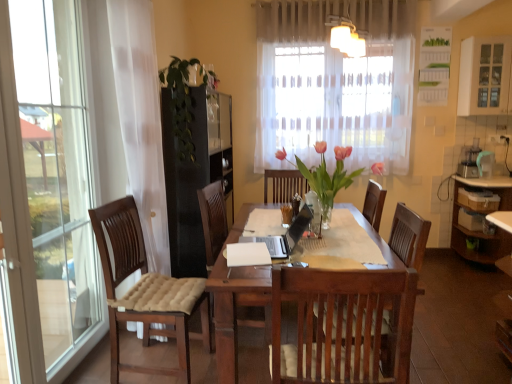
Question: Does translucent glass vase at center, acting as the 2th floral arrangement starting from the left, appear on the left side of green leafy plant at center, which is the second floral arrangement in right-to-left order?

Choices:
 (A) yes
 (B) no

Answer: (B)

Question: Does translucent glass vase at center, the first floral arrangement positioned from the right, lie in front of green leafy plant at center, placed as the 1th floral arrangement when sorted from left to right?

Choices:
 (A) no
 (B) yes

Answer: (B)

Question: Would you consider translucent glass vase at center, acting as the 2th floral arrangement starting from the left, to be distant from green leafy plant at center, which is the second floral arrangement in front-to-back order?

Choices:
 (A) yes
 (B) no

Answer: (A)

Question: Considering the relative sizes of translucent glass vase at center, the second floral arrangement in the back-to-front sequence, and green leafy plant at center, which is the second floral arrangement in front-to-back order, in the image provided, is translucent glass vase at center, the second floral arrangement in the back-to-front sequence, bigger than green leafy plant at center, which is the second floral arrangement in front-to-back order,?

Choices:
 (A) no
 (B) yes

Answer: (B)

Question: From the image's perspective, is translucent glass vase at center, acting as the first floral arrangement starting from the front, located beneath green leafy plant at center, which is the second floral arrangement in right-to-left order?

Choices:
 (A) no
 (B) yes

Answer: (B)

Question: Relative to white glass cabinet at upper right, is green leafy plant at center, which is the second floral arrangement in right-to-left order, in front or behind?

Choices:
 (A) behind
 (B) front

Answer: (B)

Question: Considering the positions of point (198, 64) and point (465, 77), is point (198, 64) closer or farther from the camera than point (465, 77)?

Choices:
 (A) closer
 (B) farther

Answer: (A)

Question: Would you say green leafy plant at center, the first floral arrangement positioned from the back, is inside or outside white glass cabinet at upper right?

Choices:
 (A) outside
 (B) inside

Answer: (A)

Question: From the image's perspective, relative to white glass cabinet at upper right, is green leafy plant at center, placed as the 1th floral arrangement when sorted from left to right, above or below?

Choices:
 (A) below
 (B) above

Answer: (A)

Question: Is translucent glass vase at center, acting as the 2th floral arrangement starting from the left, in front of or behind green leafy plant at center, which is the second floral arrangement in right-to-left order, in the image?

Choices:
 (A) front
 (B) behind

Answer: (A)

Question: From the image's perspective, is translucent glass vase at center, the second floral arrangement in the back-to-front sequence, located above or below green leafy plant at center, placed as the 1th floral arrangement when sorted from left to right?

Choices:
 (A) below
 (B) above

Answer: (A)

Question: Considering the positions of translucent glass vase at center, acting as the first floral arrangement starting from the front, and green leafy plant at center, the first floral arrangement positioned from the back, in the image, is translucent glass vase at center, acting as the first floral arrangement starting from the front, wider or thinner than green leafy plant at center, the first floral arrangement positioned from the back,?

Choices:
 (A) thin
 (B) wide

Answer: (B)

Question: From a real-world perspective, is translucent glass vase at center, the first floral arrangement positioned from the right, physically located above or below green leafy plant at center, the first floral arrangement positioned from the back?

Choices:
 (A) below
 (B) above

Answer: (A)

Question: Is translucent glass vase at center, acting as the first floral arrangement starting from the front, in front of or behind white glass cabinet at upper right in the image?

Choices:
 (A) behind
 (B) front

Answer: (B)

Question: Considering the positions of translucent glass vase at center, the first floral arrangement positioned from the right, and white glass cabinet at upper right in the image, is translucent glass vase at center, the first floral arrangement positioned from the right, taller or shorter than white glass cabinet at upper right?

Choices:
 (A) short
 (B) tall

Answer: (A)